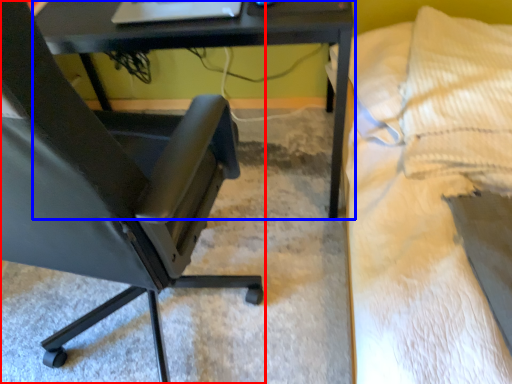
Question: Among these objects, which one is farthest to the camera, chair (highlighted by a red box) or table (highlighted by a blue box)?

Choices:
 (A) chair
 (B) table

Answer: (B)